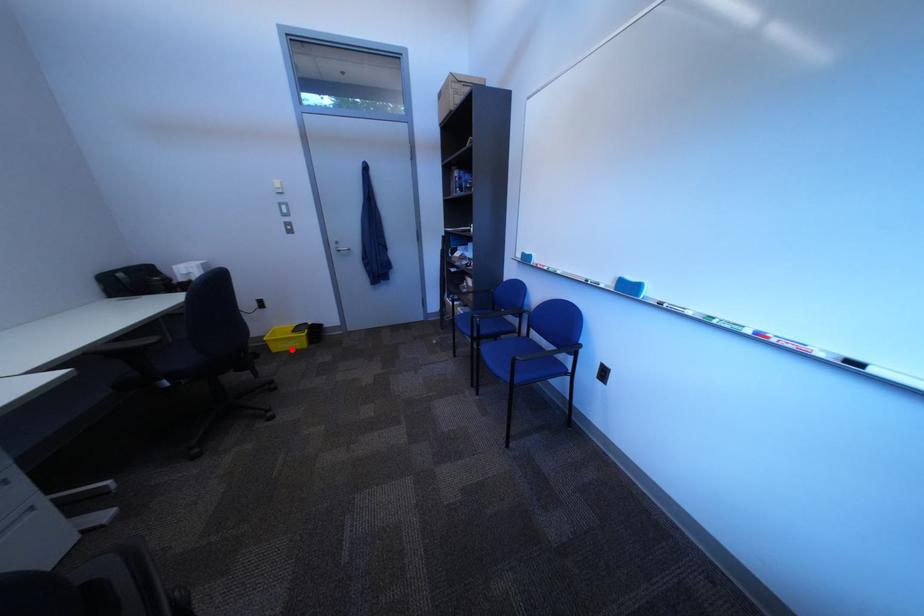
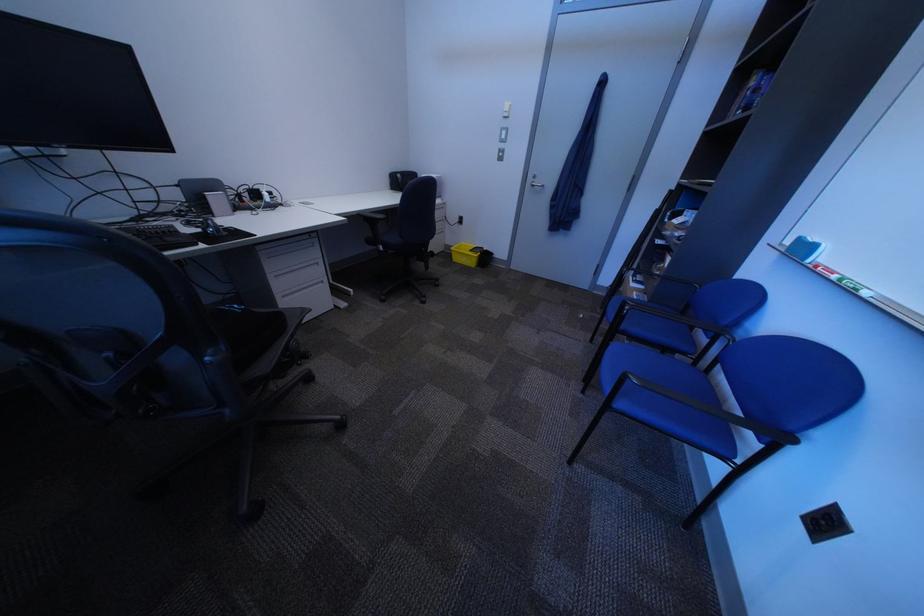
Question: I am providing you with two images of the same scene from different viewpoints. Image1 has a red point marked. In image2, the corresponding 3D location appears at what relative position? Reply with the corresponding letter.

Choices:
 (A) Closer
 (B) Farther

Answer: (A)